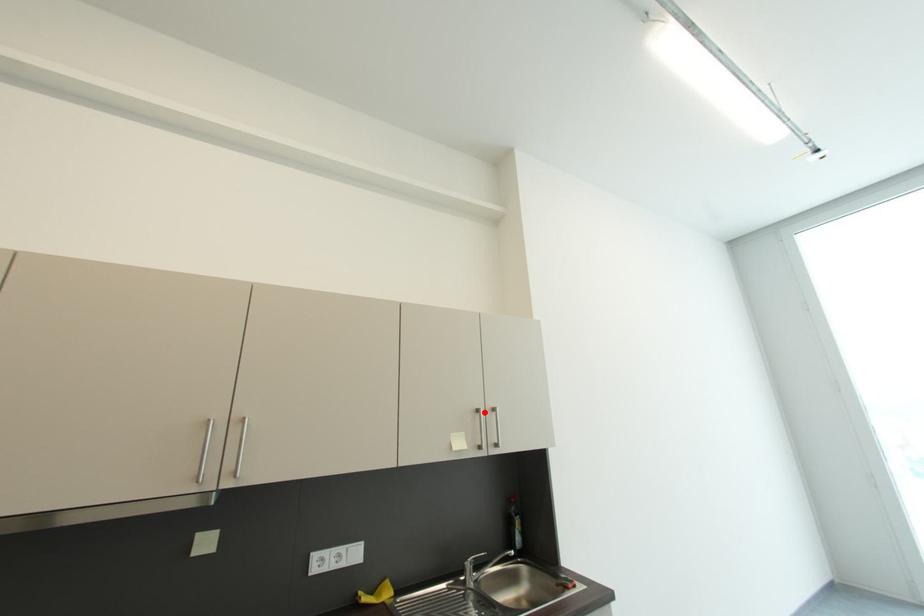
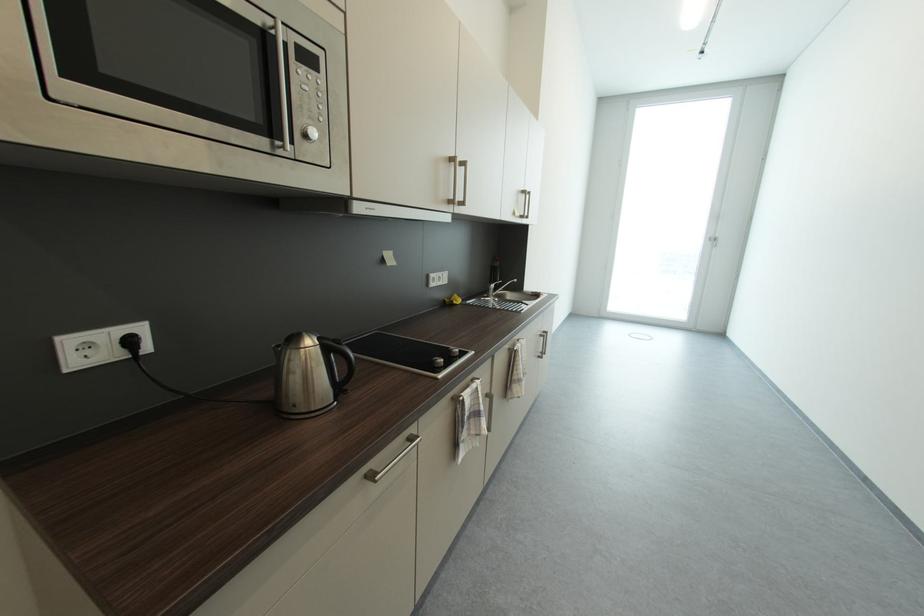
Question: A red point is marked in image1. In image2, is the corresponding 3D point closer to the camera or farther? Reply with the corresponding letter.

Choices:
 (A) The corresponding 3D point is closer.
 (B) The corresponding 3D point is farther.

Answer: (A)